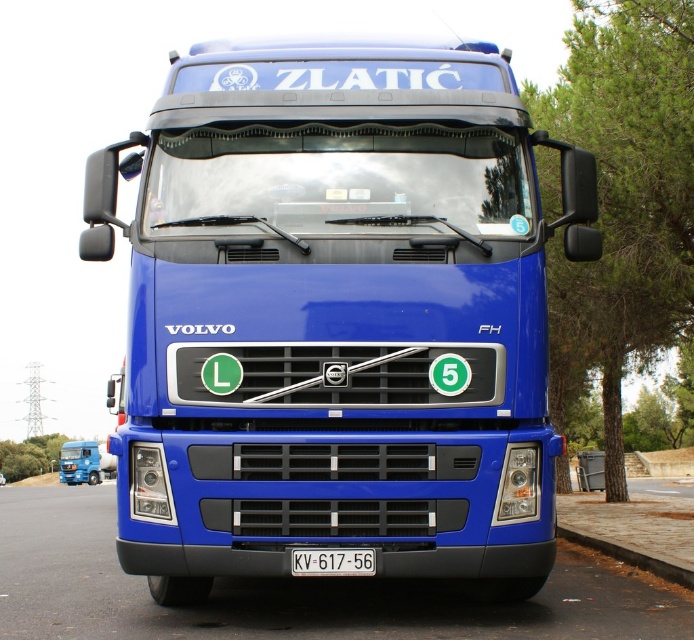
You are a delivery driver who needs to navigate a narrow alley that is only 2 meters tall. You see the blue metallic truck at center and the paved concrete curb at lower right. Which object is more likely to hit the alley ceiling first if the truck drives through?

The blue metallic truck at center is shorter than the paved concrete curb at lower right. Since the curb is taller, the curb would hit the ceiling first if the truck drives through the alley.

You are a delivery driver who needs to attach a GPS tracker to your blue metallic truck at center. The GPS tracker must be placed exactly 2 meters away from the white plastic license plate at center. Based on the truck layout, can you position the tracker within the required distance?

The distance between the blue metallic truck at center and the white plastic license plate at center is 2.32 meters. Since the GPS tracker needs to be placed exactly 2 meters away, it can be positioned within the required distance as 2.32 meters is greater than 2 meters.

You are a delivery driver who needs to enter a low clearance tunnel that allows vehicles up to 4 meters in height. You are driving the blue metallic truck at center. Can you safely pass through the tunnel with the white plastic license plate at center still attached?

The blue metallic truck at center is much taller than the white plastic license plate at center. Since the truck itself is already much taller than the license plate, and the tunnel allows vehicles up to 4 meters, you need to check the truck height. If the truck is under 4 meters, it can pass. However, the license plate height isn not a factor here as it is part of the truck. Please confirm the truck height.